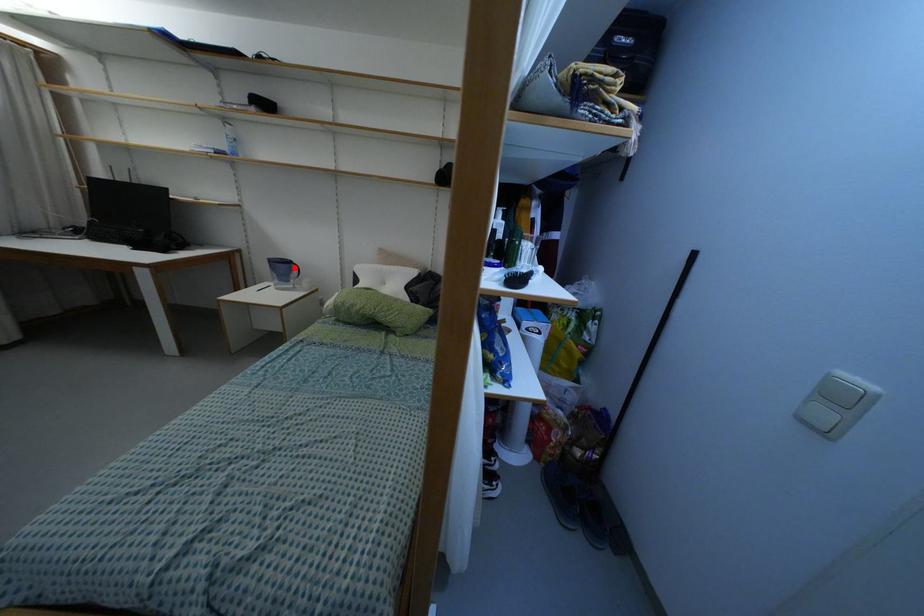
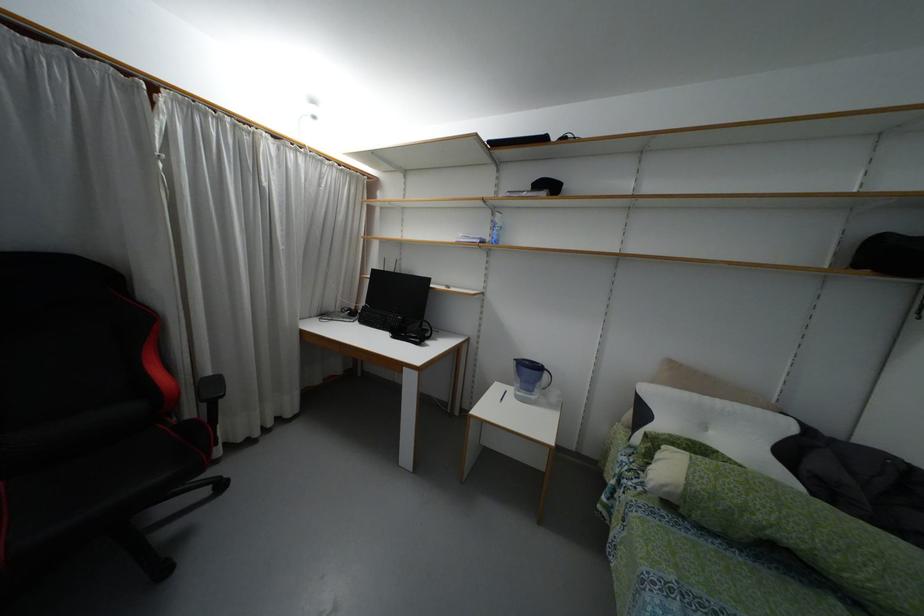
Locate, in the second image, the point that corresponds to the highlighted location in the first image.

(544, 375)